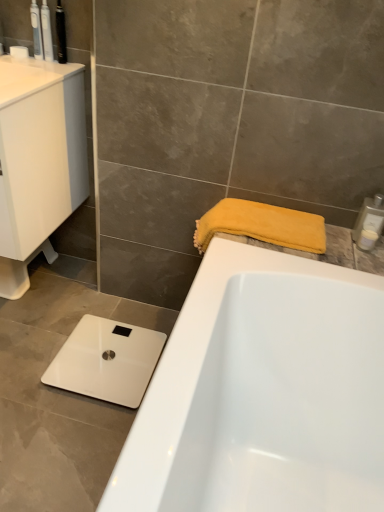
This screenshot has width=384, height=512. In order to click on free region on the left part of white plastic soap dispenser at upper right, which is the 5th toiletry in top-to-bottom order in this screenshot , I will do `click(327, 247)`.